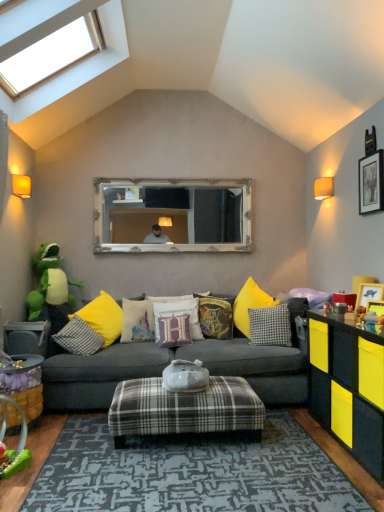
Question: Considering the relative positions of velvet purple pillow at center, marked as the fourth pillow in a right-to-left arrangement, and velvet harry potter cushion at center, the fifth pillow when ordered from left to right, in the image provided, is velvet purple pillow at center, marked as the fourth pillow in a right-to-left arrangement, in front of velvet harry potter cushion at center, the fifth pillow when ordered from left to right,?

Choices:
 (A) no
 (B) yes

Answer: (B)

Question: Is velvet purple pillow at center, marked as the fourth pillow in a right-to-left arrangement, facing towards velvet harry potter cushion at center, which is the 3th pillow in right-to-left order?

Choices:
 (A) yes
 (B) no

Answer: (B)

Question: Is velvet purple pillow at center, positioned as the fourth pillow in left-to-right order, bigger than velvet harry potter cushion at center, which is the 3th pillow in right-to-left order?

Choices:
 (A) yes
 (B) no

Answer: (B)

Question: Is velvet purple pillow at center, positioned as the fourth pillow in left-to-right order, in contact with velvet harry potter cushion at center, which is the 3th pillow in right-to-left order?

Choices:
 (A) yes
 (B) no

Answer: (A)

Question: From the image's perspective, would you say velvet purple pillow at center, marked as the fourth pillow in a right-to-left arrangement, is shown under velvet harry potter cushion at center, the fifth pillow when ordered from left to right?

Choices:
 (A) yes
 (B) no

Answer: (A)

Question: In terms of size, does metallic silver tray at lower left, the second table positioned from the front, appear bigger or smaller than wooden framed picture at upper right, placed as the third picture frame when sorted from bottom to top?

Choices:
 (A) big
 (B) small

Answer: (A)

Question: Considering their positions, is metallic silver tray at lower left, the second table positioned from the front, located in front of or behind wooden framed picture at upper right, which is counted as the 1th picture frame, starting from the top?

Choices:
 (A) front
 (B) behind

Answer: (B)

Question: Is metallic silver tray at lower left, the second table positioned from the bottom, spatially inside wooden framed picture at upper right, which is counted as the 1th picture frame, starting from the top, or outside of it?

Choices:
 (A) inside
 (B) outside

Answer: (B)

Question: Visually, is metallic silver tray at lower left, the second table positioned from the bottom, positioned to the left or to the right of wooden framed picture at upper right, placed as the third picture frame when sorted from bottom to top?

Choices:
 (A) right
 (B) left

Answer: (B)

Question: In terms of height, does checkered fabric pillow at center, arranged as the 7th pillow when viewed from the right, look taller or shorter compared to wooden picture frame at right, which is the 2th picture frame from bottom to top?

Choices:
 (A) tall
 (B) short

Answer: (A)

Question: Relative to wooden picture frame at right, placed as the 2th picture frame when sorted from back to front, is checkered fabric pillow at center, arranged as the 7th pillow when viewed from the right, in front or behind?

Choices:
 (A) behind
 (B) front

Answer: (A)

Question: From the image's perspective, is checkered fabric pillow at center, arranged as the 7th pillow when viewed from the right, above or below wooden picture frame at right, placed as the 2th picture frame when sorted from back to front?

Choices:
 (A) below
 (B) above

Answer: (A)

Question: Is checkered fabric pillow at center, arranged as the 7th pillow when viewed from the right, inside or outside of wooden picture frame at right, which appears as the 2th picture frame when viewed from the front?

Choices:
 (A) inside
 (B) outside

Answer: (B)

Question: Is point (187, 326) closer or farther from the camera than point (114, 391)?

Choices:
 (A) closer
 (B) farther

Answer: (B)

Question: From the image's perspective, is velvet purple pillow at center, marked as the fourth pillow in a right-to-left arrangement, located above or below plaid fabric ottoman at center?

Choices:
 (A) below
 (B) above

Answer: (B)